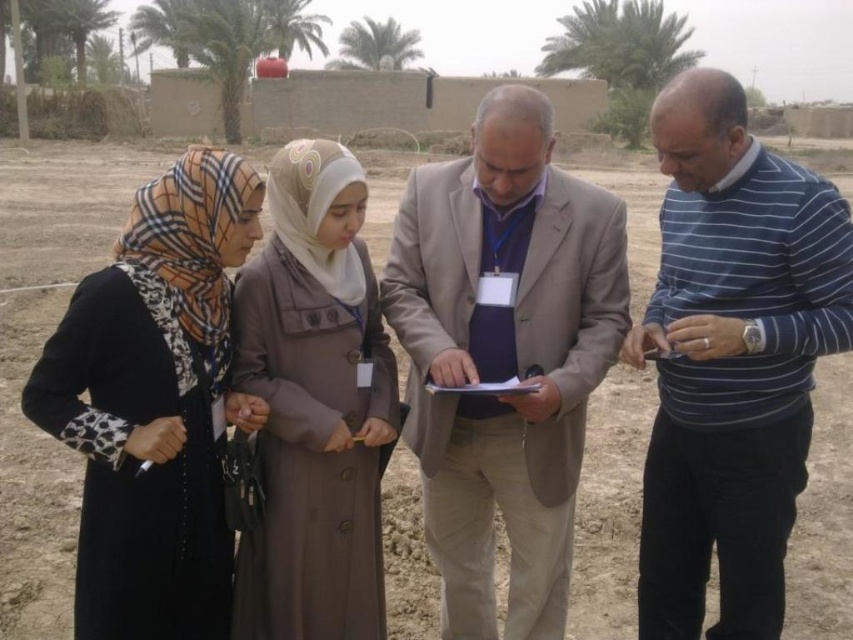
You are a photographer setting up a photo shoot for a fashion magazine. You have two outfits to feature in the image, the beige fabric suit at center and the black fabric hijab at left. The magazine requires that the outfit with the larger width must be placed in the foreground to emphasize its prominence. Based on the scene description, which outfit should be positioned in the foreground?

The beige fabric suit at center has a larger width than the black fabric hijab at left, so it should be placed in the foreground to emphasize its prominence as required.

You are a photographer setting up a photo shoot for two models wearing the beige fabric suit at center and the blue striped sweater at center. The scene requires the models to stand side by side. Given their clothing widths, which model should stand on the left to ensure their outfits don not overlap?

The beige fabric suit at center is wider than the blue striped sweater at center. To prevent overlapping, the model wearing the beige fabric suit at center should stand on the left so their wider outfit does not extend into the space of the narrower blue striped sweater at center.